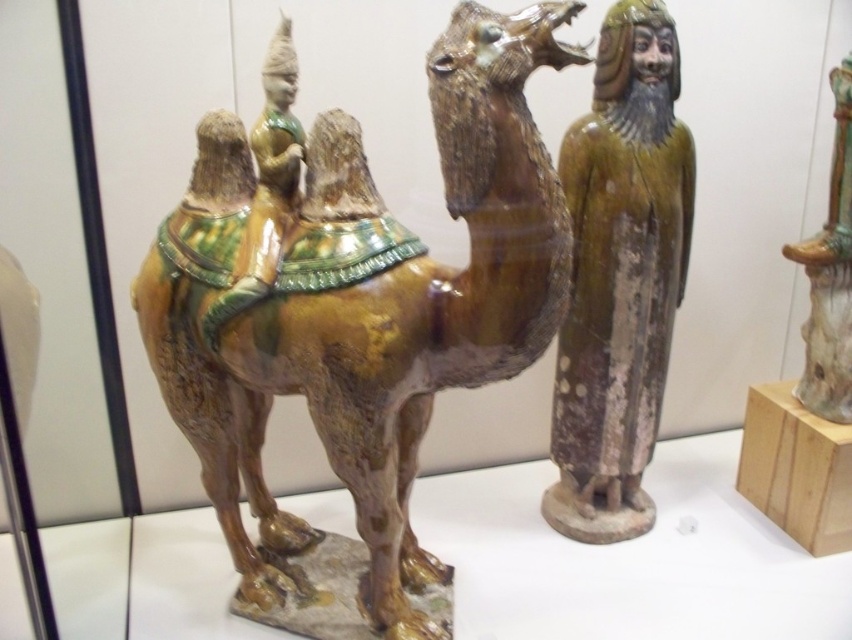
Question: Which point appears closest to the camera in this image?

Choices:
 (A) (498, 250)
 (B) (826, 250)
 (C) (626, 246)

Answer: (A)

Question: Which point is closer to the camera taking this photo?

Choices:
 (A) (363, 401)
 (B) (809, 320)

Answer: (A)

Question: Can you confirm if green glazed figure at center is thinner than shiny green ceramic vase at upper right?

Choices:
 (A) yes
 (B) no

Answer: (B)

Question: Estimate the real-world distances between objects in this image. Which object is closer to the shiny green ceramic vase at upper right?

Choices:
 (A) brown glossy camel at center
 (B) green glazed figure at center

Answer: (B)

Question: Is green glazed figure at center above shiny green ceramic vase at upper right?

Choices:
 (A) yes
 (B) no

Answer: (B)

Question: Is green glazed figure at center positioned before shiny green ceramic vase at upper right?

Choices:
 (A) yes
 (B) no

Answer: (A)